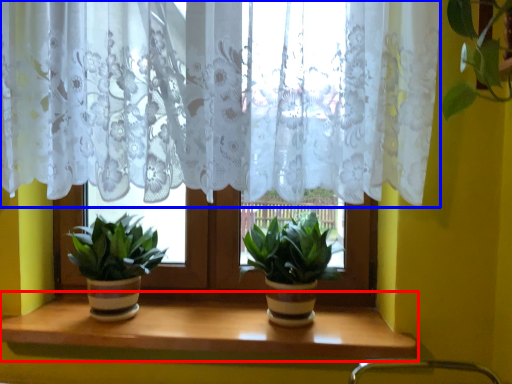
Question: Which of the following is the closest to the observer, window sill (highlighted by a red box) or curtain (highlighted by a blue box)?

Choices:
 (A) window sill
 (B) curtain

Answer: (B)